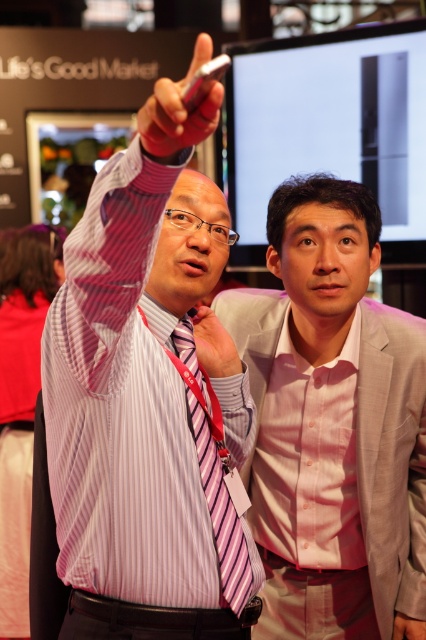
Question: Can you confirm if pink striped shirt at upper left is thinner than matte pink phone at upper center?

Choices:
 (A) yes
 (B) no

Answer: (B)

Question: Is pink striped shirt at upper left closer to the viewer compared to pink satin shirt at center?

Choices:
 (A) no
 (B) yes

Answer: (B)

Question: Is striped fabric shirt at left wider than pink striped tie at center?

Choices:
 (A) no
 (B) yes

Answer: (B)

Question: Which point appears farthest from the camera in this image?

Choices:
 (A) (262, 323)
 (B) (166, 109)

Answer: (A)

Question: Which object appears closest to the camera in this image?

Choices:
 (A) pink striped tie at center
 (B) pink satin shirt at center

Answer: (A)

Question: Based on their relative distances, which object is farther from the matte pink phone at upper center?

Choices:
 (A) pink satin shirt at center
 (B) pink fabric at upper center

Answer: (A)